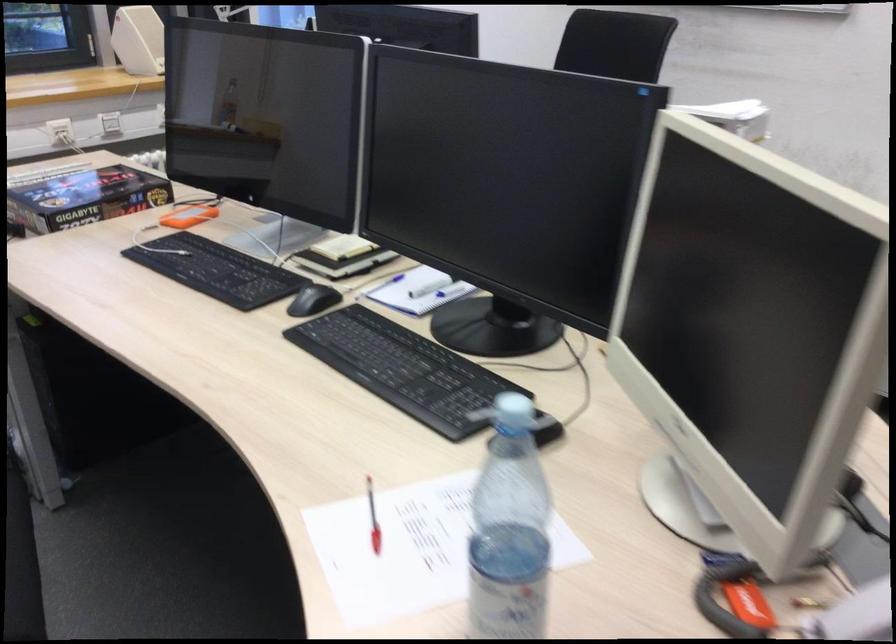
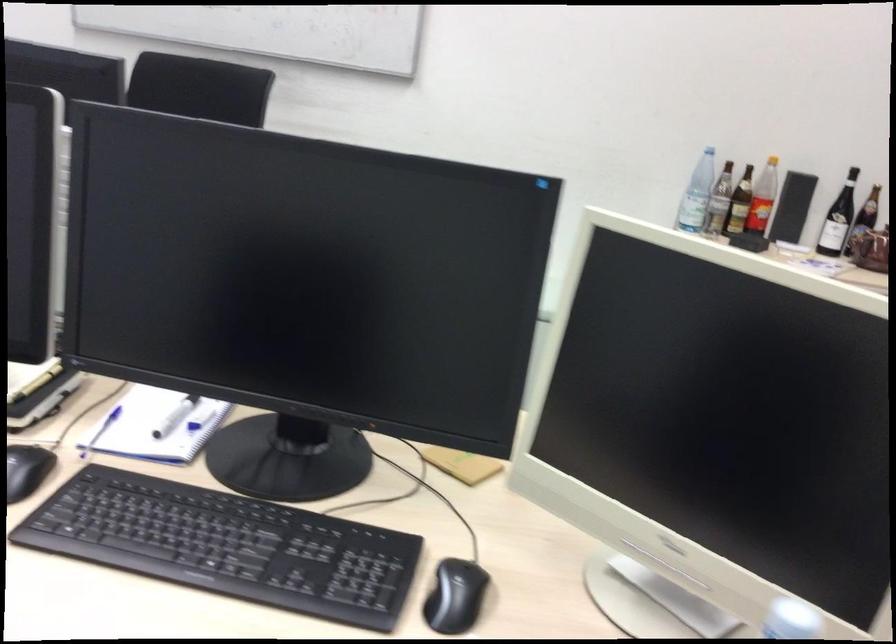
Question: How did the camera likely rotate?

Choices:
 (A) Left
 (B) Right
 (C) Up
 (D) Down

Answer: (B)